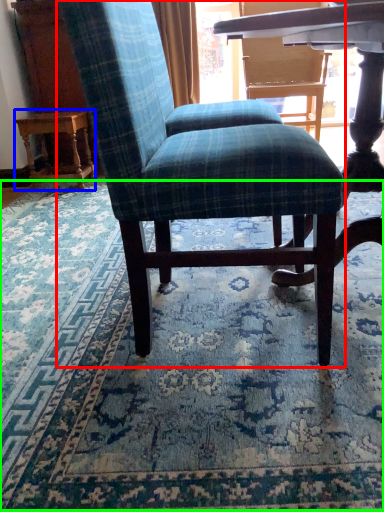
Question: Considering the real-world distances, which object is closest to chair (highlighted by a red box)? table (highlighted by a blue box) or mat (highlighted by a green box).

Choices:
 (A) table
 (B) mat

Answer: (B)